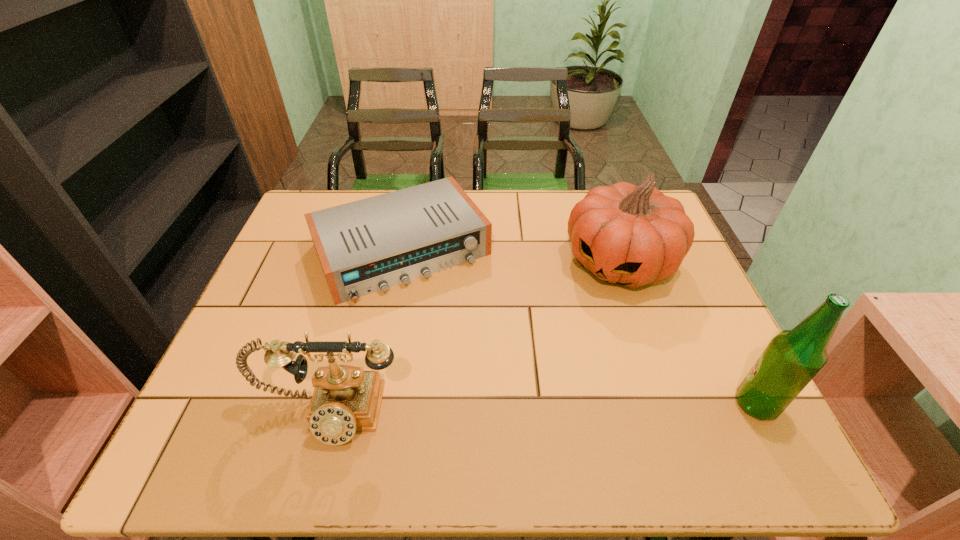
I want to click on free space on the desktop that is between the third tallest object and the tallest object and is positioned on the face of the pumpkin, so click(511, 409).

This screenshot has width=960, height=540. What are the coordinates of `free space on the desktop that is between the telephone and the beer bottle and is positioned on the front panel of the radio receiver` in the screenshot? It's located at (492, 410).